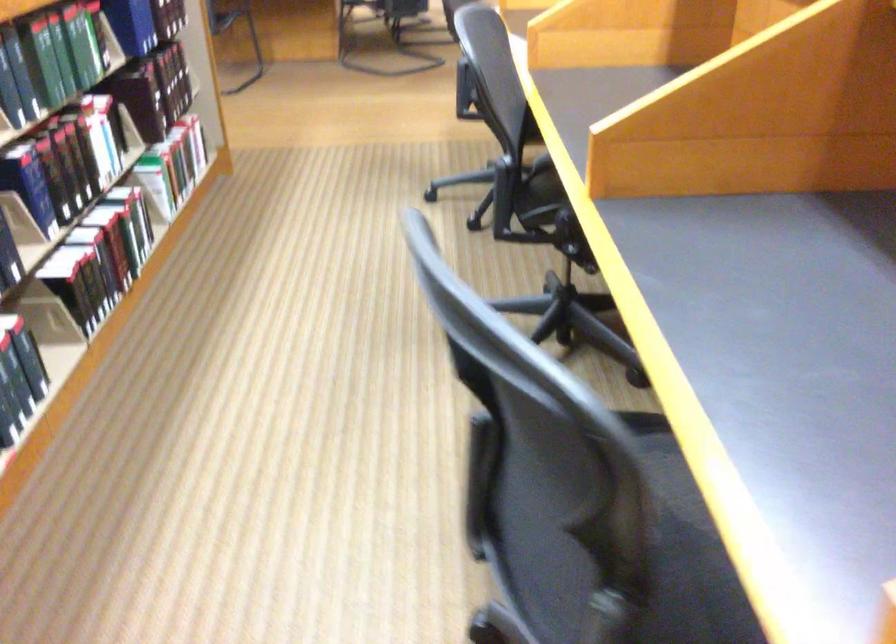
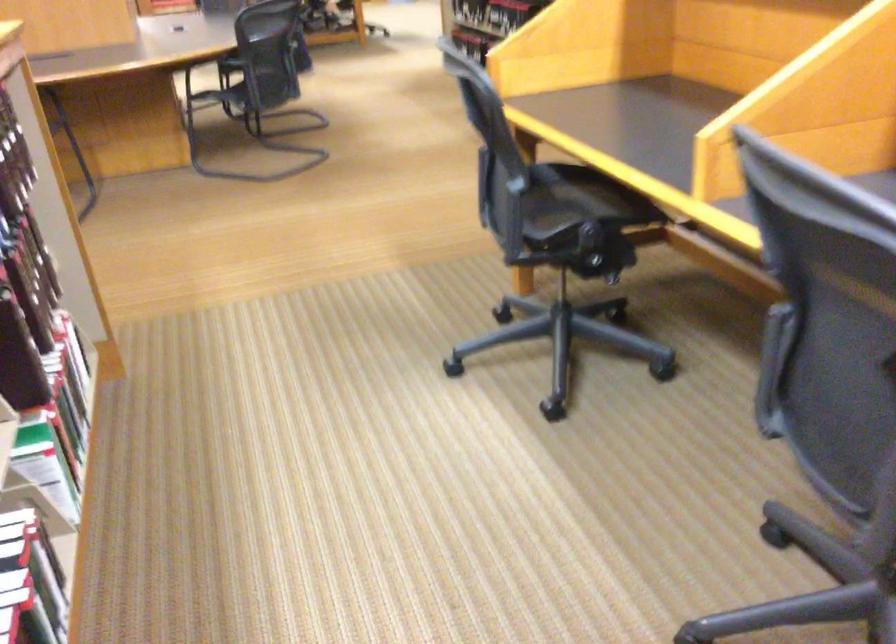
The point at (148,111) is marked in the first image. Where is the corresponding point in the second image?

(19, 359)